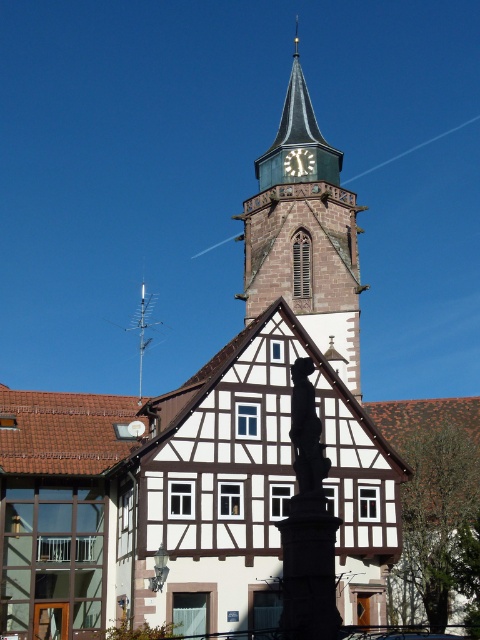
Question: Can you confirm if smooth gray stone clock tower at center is bigger than silver metallic antenna at upper center?

Choices:
 (A) no
 (B) yes

Answer: (B)

Question: From the image, what is the correct spatial relationship of smooth gray stone clock tower at center in relation to silver metallic antenna at upper center?

Choices:
 (A) above
 (B) below

Answer: (A)

Question: Which point is farther to the camera?

Choices:
 (A) white wooden clock at upper center
 (B) smooth gray stone clock tower at center

Answer: (A)

Question: Can you confirm if silver metallic antenna at upper center is wider than white wooden clock at upper center?

Choices:
 (A) no
 (B) yes

Answer: (B)

Question: Among these objects, which one is nearest to the camera?

Choices:
 (A) silver metallic antenna at upper center
 (B) smooth gray stone clock tower at center

Answer: (A)

Question: Among these objects, which one is farthest from the camera?

Choices:
 (A) white wooden clock at upper center
 (B) silver metallic antenna at upper center

Answer: (A)